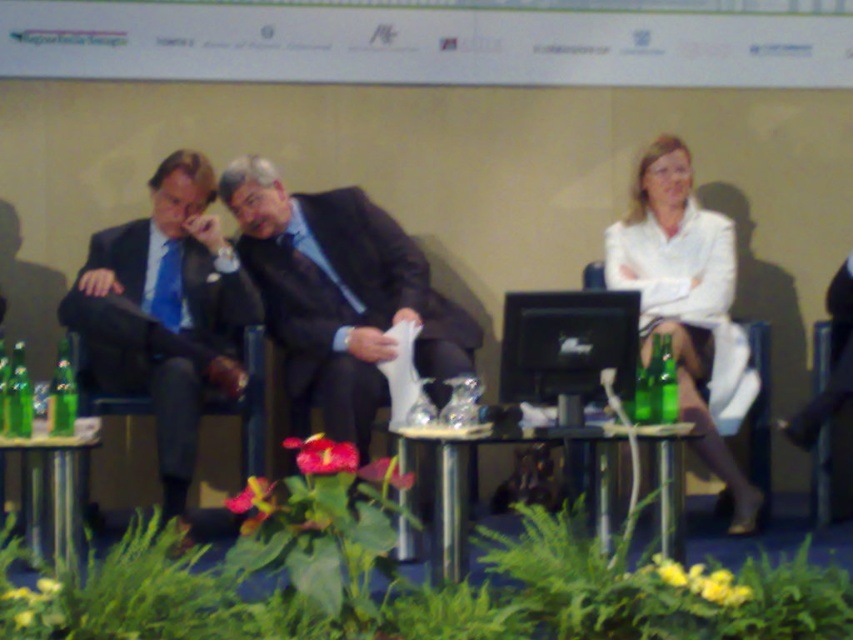
Question: Can you confirm if dark suit at center is smaller than clear glass table at center?

Choices:
 (A) yes
 (B) no

Answer: (B)

Question: Is matte black suit at left positioned behind clear glass table at center?

Choices:
 (A) no
 (B) yes

Answer: (B)

Question: Is clear glass table at center behind green glass bottle at left?

Choices:
 (A) yes
 (B) no

Answer: (B)

Question: Which point is farther from the camera taking this photo?

Choices:
 (A) (758, 516)
 (B) (125, 237)
 (C) (595, 504)

Answer: (B)

Question: Which point is closer to the camera taking this photo?

Choices:
 (A) (10, 403)
 (B) (73, 380)
 (C) (280, 284)

Answer: (A)

Question: Which point is farther to the camera?

Choices:
 (A) dark suit at center
 (B) white matte blazer at upper right

Answer: (A)